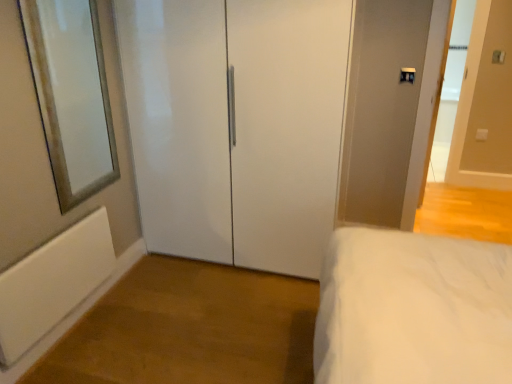
Question: Relative to white glossy door at upper right, marked as the second door in a left-to-right arrangement, is silver-framed mirror at left in front or behind?

Choices:
 (A) front
 (B) behind

Answer: (A)

Question: Is silver-framed mirror at left to the left or to the right of white glossy door at upper right, which is the first door in right-to-left order, in the image?

Choices:
 (A) right
 (B) left

Answer: (B)

Question: Which object is the farthest from the white glossy door at upper right, which is the first door in right-to-left order?

Choices:
 (A) silver-framed mirror at left
 (B) white matte radiator at lower left
 (C) white glossy closet doors at center, positioned as the 1th door in left-to-right order

Answer: (B)

Question: Which of these objects is positioned farthest from the white glossy closet doors at center, which is the second door in right-to-left order?

Choices:
 (A) white glossy door at upper right, which is the first door in right-to-left order
 (B) silver-framed mirror at left
 (C) white matte radiator at lower left

Answer: (A)